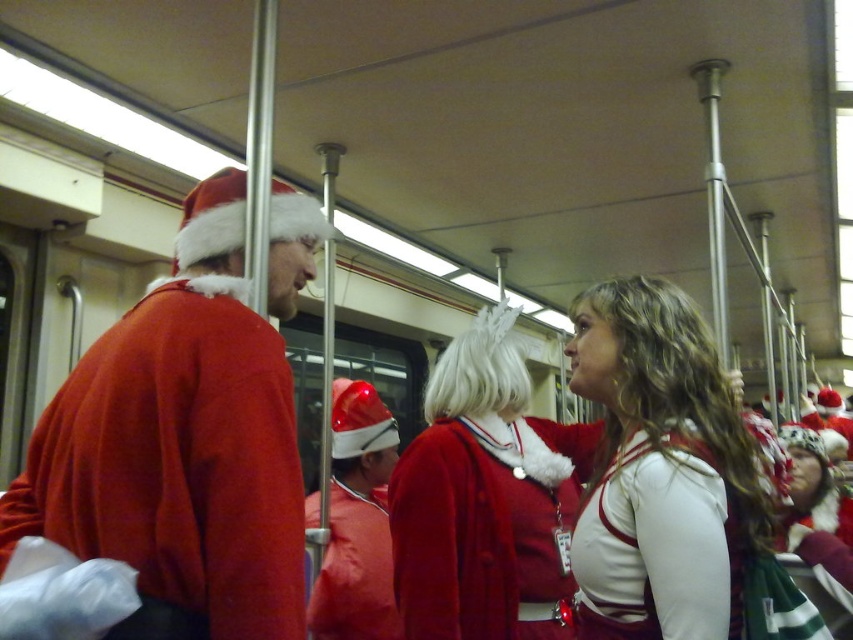
You are a photographer standing in the subway car and want to take a photo of both the matte red sweater at left and the fuzzy red coat at center. Which one should you focus on first if you want to capture them in order from left to right?

You should focus on the matte red sweater at left first since it is positioned to the left of the fuzzy red coat at center, following the left to right order.

You are standing in the subway car and want to take a photo of both the point at coordinates (268, 532) and the point at coordinates (637, 547). Since you can only focus on one point at a time, which point should you focus on to ensure the other point is still in the background? Please provide your answer based on their positions relative to the camera.

You should focus on point (268, 532) because it is closer to the camera, allowing the farther point (637, 547) to remain in the background.